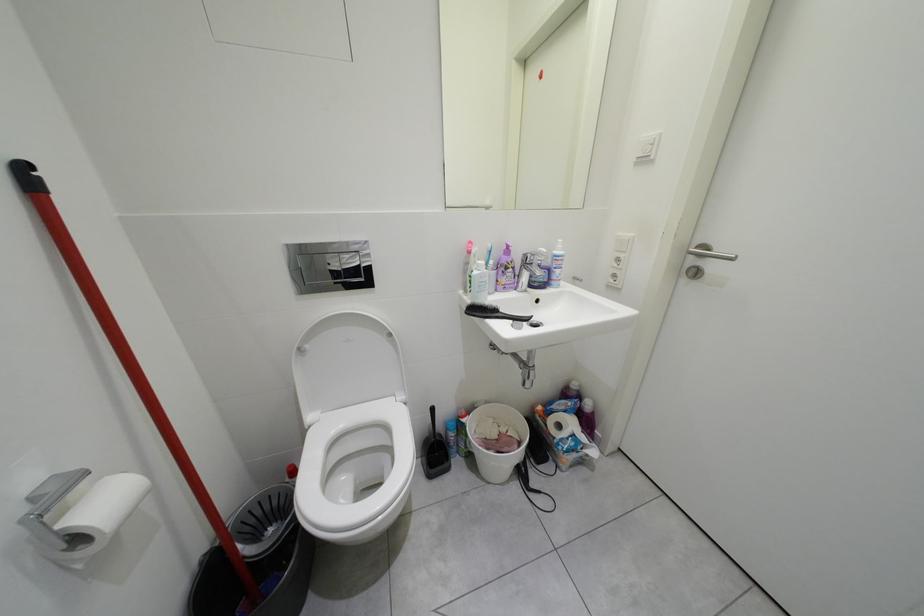
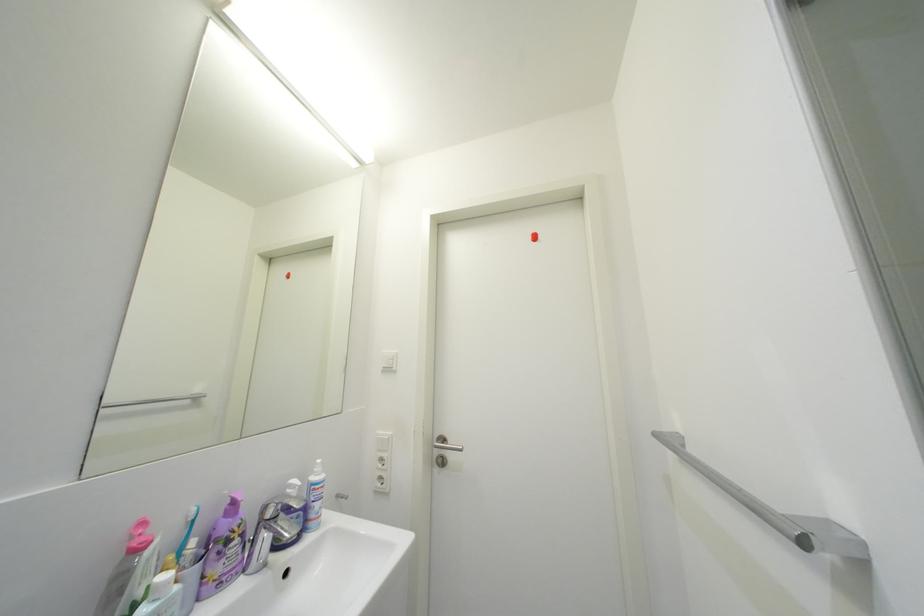
The images are taken continuously from a first-person perspective. In which direction is your viewpoint rotating?

The rotation direction of the camera is right-up.